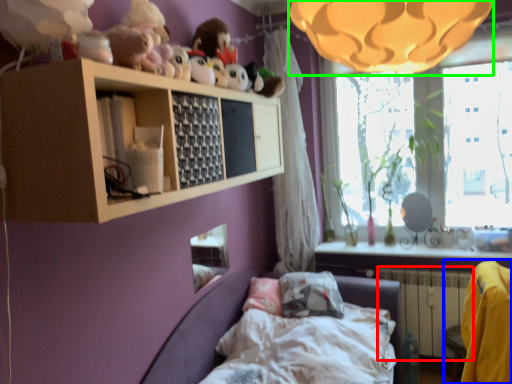
Question: Considering the real-world distances, which object is farthest from radiator (highlighted by a red box)? armchair (highlighted by a blue box) or lamp (highlighted by a green box)?

Choices:
 (A) armchair
 (B) lamp

Answer: (B)